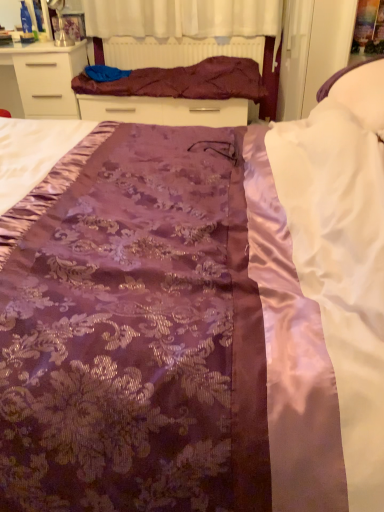
Question: Based on their positions, is purple satin blanket at upper center located to the left or right of matte white chest of drawers at upper left?

Choices:
 (A) left
 (B) right

Answer: (B)

Question: Considering the positions of purple satin blanket at upper center and matte white chest of drawers at upper left in the image, is purple satin blanket at upper center taller or shorter than matte white chest of drawers at upper left?

Choices:
 (A) tall
 (B) short

Answer: (B)

Question: Estimate the real-world distances between objects in this image. Which object is farther from the white satin pillow at upper right?

Choices:
 (A) purple satin bed frame at upper center
 (B) purple satin blanket at upper center
 (C) matte white chest of drawers at upper left

Answer: (C)

Question: Based on their relative distances, which object is nearer to the purple satin blanket at upper center?

Choices:
 (A) matte white chest of drawers at upper left
 (B) white satin pillow at upper right
 (C) purple satin bed frame at upper center

Answer: (C)